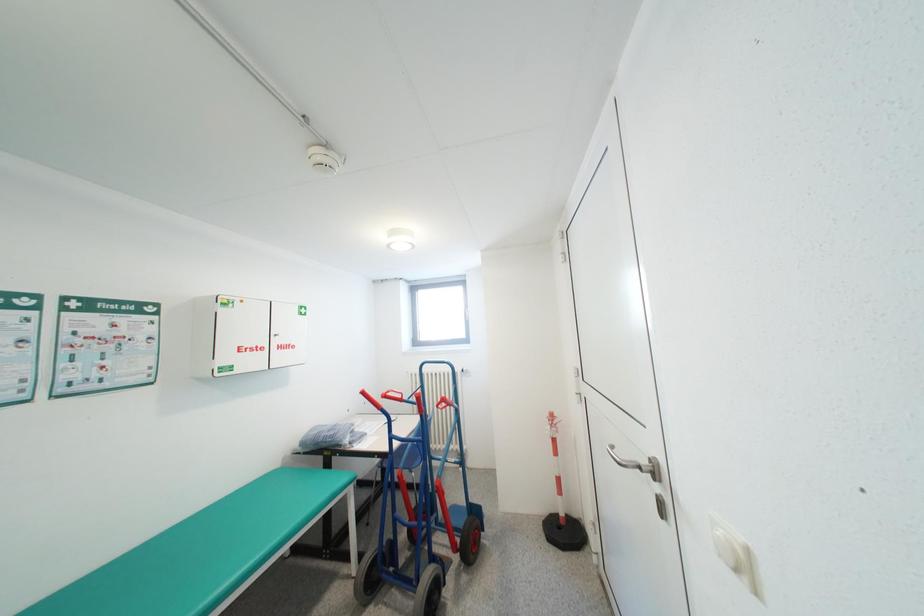
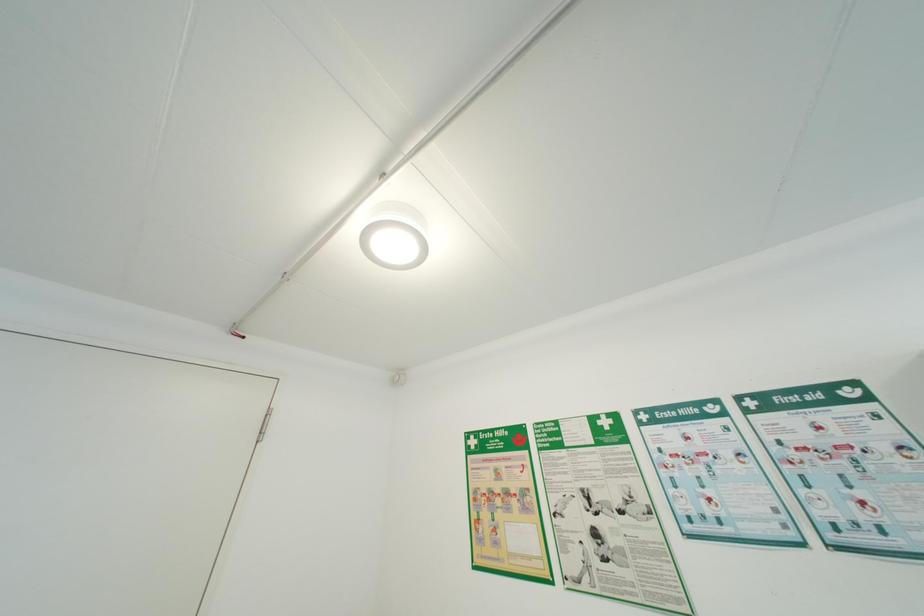
Consider the image. The images are taken continuously from a first-person perspective. In which direction is your viewpoint rotating?

The camera rotated toward left-up.